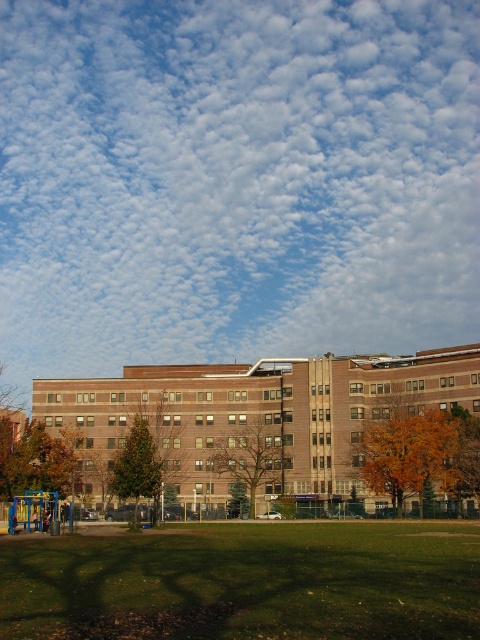
You are standing in front of the large building and want to find the orange leafy tree at center. According to the coordinates provided, in which direction should you look to locate it?

The orange leafy tree at center is located at coordinates point (420, 454), which means it is positioned to the lower right of the image. Therefore, you should look towards the lower right direction to find it.

You are standing in front of the building and want to find a spot to place a picnic blanket. The green grass at lower center and the green matte tree at center are in your view. Which area is suitable for placing the blanket?

The green grass at lower center is suitable for placing the picnic blanket because it is located below the green matte tree at center, making it an open space free from obstacles.

You are standing at the point closest to the building in the image. Which of the two points, point (344, 184) or point (134, 445), is farther away from you?

Point (344, 184) is farther away from you because it is behind point (134, 445).